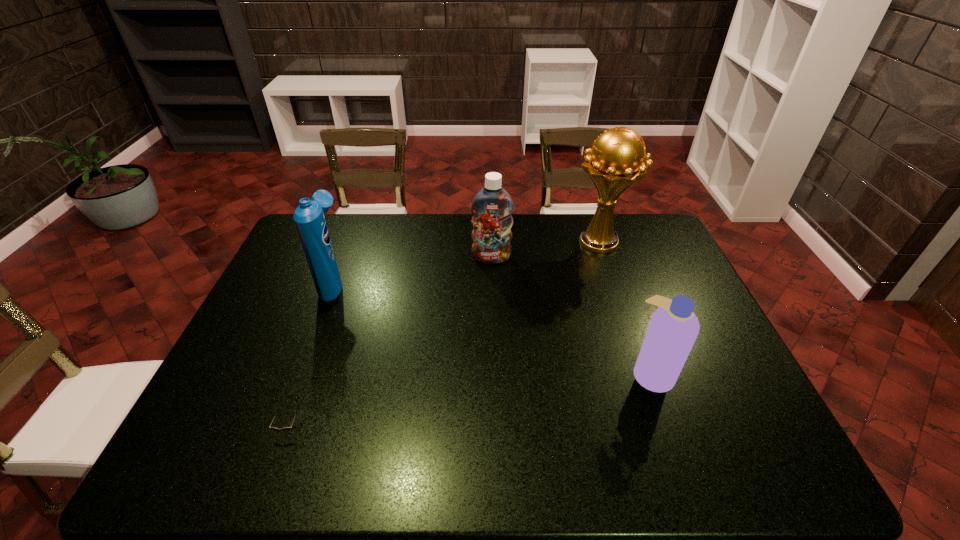
You are a GUI agent. You are given a task and a screenshot of the screen. Output one action in this format:
    pyautogui.click(x=<x>, y=<y>)
    Task: Click on the blank area at the right edge
    The width and height of the screenshot is (960, 540).
    Given the screenshot: What is the action you would take?
    pyautogui.click(x=675, y=261)

Find the location of `free region at the far left corner of the desktop`. free region at the far left corner of the desktop is located at coordinates (338, 228).

The image size is (960, 540). In order to click on free space at the far right corner of the desktop in this screenshot , I will do `click(633, 246)`.

Identify the location of empty location between the leftmost shampoo and the nearest object. Image resolution: width=960 pixels, height=540 pixels. (311, 356).

Image resolution: width=960 pixels, height=540 pixels. Identify the location of free spot between the third object from right to left and the leftmost shampoo. (413, 270).

Where is `free space that is in between the fourth farthest object and the sunglasses`? This screenshot has width=960, height=540. free space that is in between the fourth farthest object and the sunglasses is located at coordinates (469, 402).

Where is `free space that is in between the third object from right to left and the trophy_cup`? Image resolution: width=960 pixels, height=540 pixels. free space that is in between the third object from right to left and the trophy_cup is located at coordinates (545, 251).

You are a GUI agent. You are given a task and a screenshot of the screen. Output one action in this format:
    pyautogui.click(x=<x>, y=<y>)
    Task: Click on the empty space that is in between the leftmost shampoo and the rightmost shampoo
    The height and width of the screenshot is (540, 960).
    Given the screenshot: What is the action you would take?
    pyautogui.click(x=492, y=328)

Image resolution: width=960 pixels, height=540 pixels. In order to click on free spot between the second shampoo from left to right and the fourth farthest object in this screenshot , I will do `click(571, 316)`.

Find the location of a particular element. vacant region between the nearest shampoo and the tallest object is located at coordinates (625, 308).